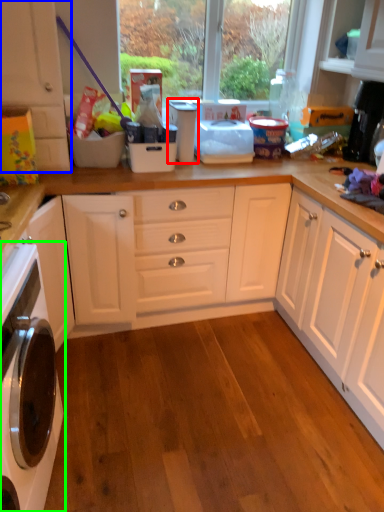
Question: Based on their relative distances, which object is nearer to appliance (highlighted by a red box)? Choose from cabinetry (highlighted by a blue box) and home appliance (highlighted by a green box).

Choices:
 (A) cabinetry
 (B) home appliance

Answer: (A)